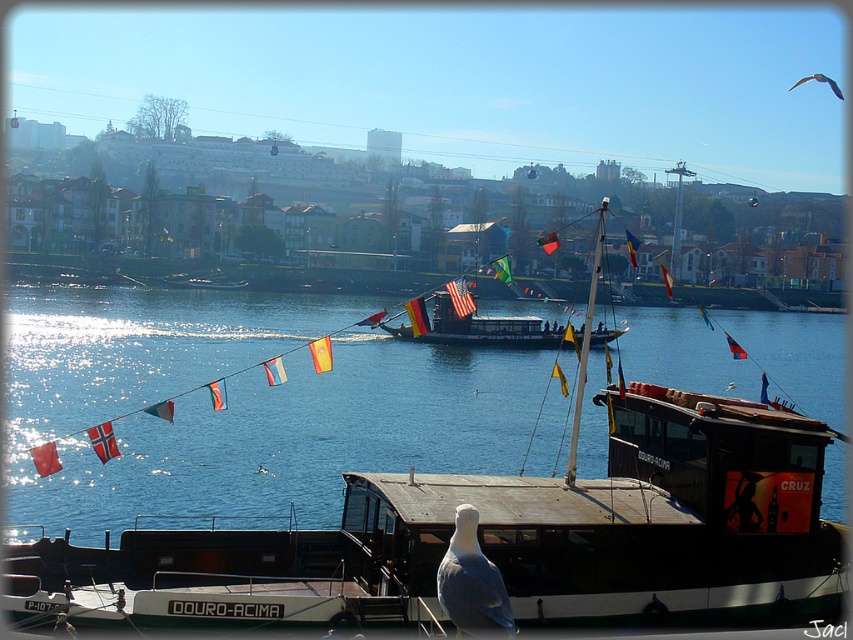
Question: Which point is farther from the camera taking this photo?

Choices:
 (A) (299, 324)
 (B) (795, 83)

Answer: (B)

Question: Which of these objects is positioned farthest from the wooden sailboat at center?

Choices:
 (A) gray feathered bird at upper right
 (B) white feathered bird at center
 (C) shiny black boat at center
 (D) blue water at center

Answer: (A)

Question: Is blue water at center smaller than white feathered bird at center?

Choices:
 (A) yes
 (B) no

Answer: (B)

Question: In this image, where is shiny black boat at center located relative to gray feathered bird at upper right?

Choices:
 (A) above
 (B) below

Answer: (B)

Question: Is wooden sailboat at center further to the viewer compared to white feathered bird at center?

Choices:
 (A) yes
 (B) no

Answer: (A)

Question: Estimate the real-world distances between objects in this image. Which object is closer to the white feathered bird at center?

Choices:
 (A) gray feathered bird at upper right
 (B) blue water at center
 (C) shiny black boat at center
 (D) wooden sailboat at center

Answer: (D)